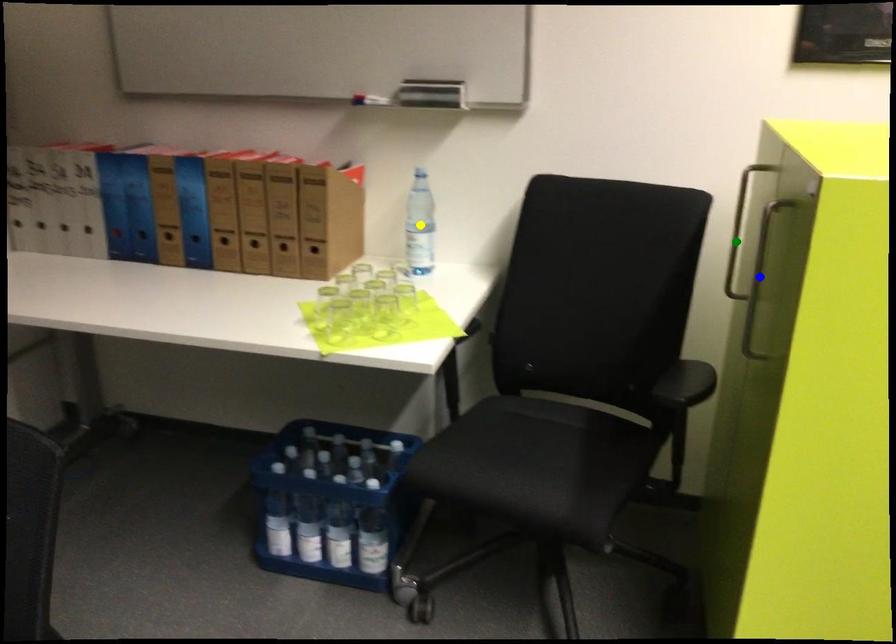
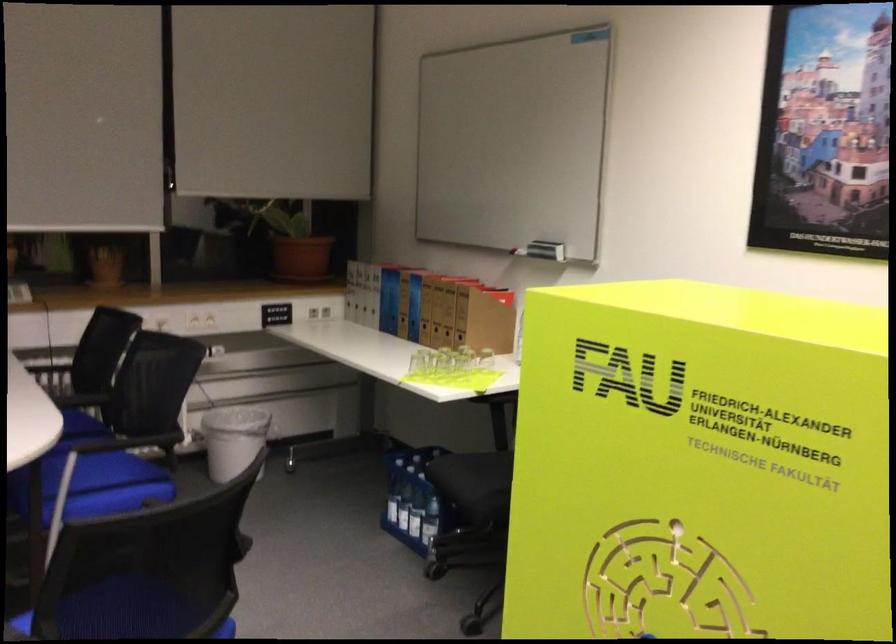
I am providing you with two images of the same scene from different viewpoints. Three points are marked in image1. Which point corresponds to a part or object that is occluded in image2?In image1, three points are marked. Which of them correspond to a part or object that is occluded in image2?Among the three points shown in image1, which one corresponds to a part or object that is no longer visible due to occlusion in image2?

Invisible in image2: green point, blue point, yellow point.